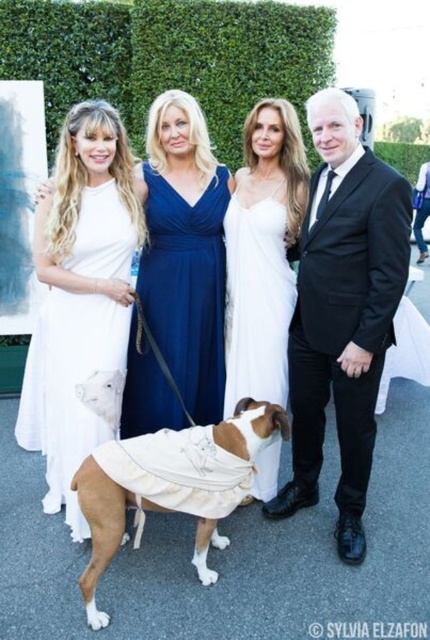
Is black satin suit at right taller than white satin dress at lower left?

Yes, black satin suit at right is taller than white satin dress at lower left.

Can you confirm if black satin suit at right is positioned above white satin dress at lower left?

Indeed, black satin suit at right is positioned over white satin dress at lower left.

Is point (306, 440) less distant than point (37, 369)?

That is True.

Locate an element on the screen. This screenshot has width=430, height=640. black satin suit at right is located at coordinates (343, 310).

Who is lower down, blue satin dress at center or white satin dress at center?

Positioned lower is blue satin dress at center.

This screenshot has height=640, width=430. What are the coordinates of `blue satin dress at center` in the screenshot? It's located at (187, 288).

Between white satin dress at center and white textured coat at center, which one appears on the right side from the viewer's perspective?

Positioned to the right is white satin dress at center.

Can you confirm if white satin dress at center is positioned to the right of white textured coat at center?

Indeed, white satin dress at center is positioned on the right side of white textured coat at center.

Is point (242, 276) more distant than point (203, 449)?

Yes.

Image resolution: width=430 pixels, height=640 pixels. I want to click on white satin dress at center, so click(x=263, y=252).